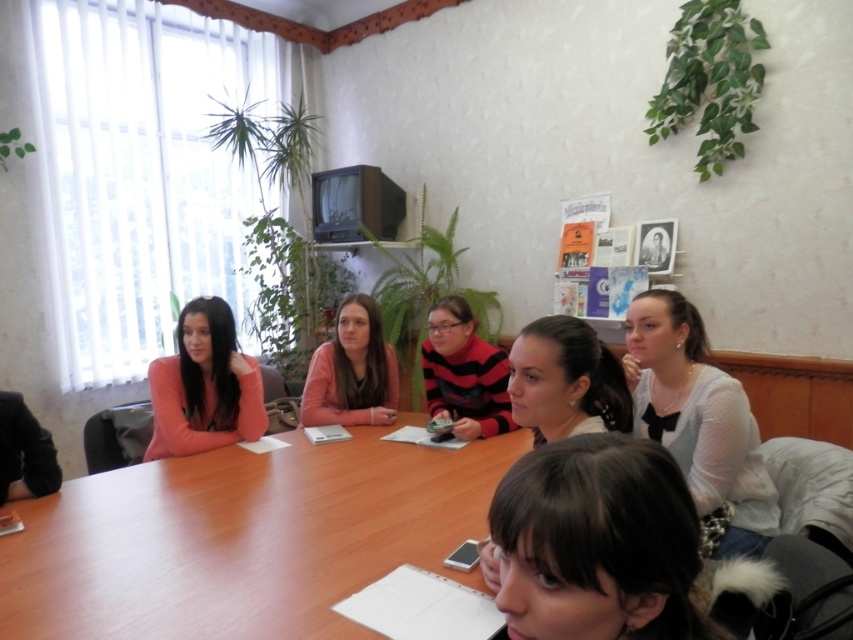
You are a photographer trying to capture a closeup of the dark brown hair at lower center without the smooth brown hair at center appearing in the frame. Is this possible based on their positions?

Yes, since the dark brown hair at lower center is in front of the smooth brown hair at center, you can focus on the dark brown hair at lower center and exclude the smooth brown hair at center from the frame by adjusting your angle or zoom.

From the picture: You are a photographer trying to capture a closeup of the dark brown hair at lower center and the smooth brown hair at center. Which hair is shorter and therefore easier to focus on without adjusting your camera lens?

The dark brown hair at lower center is shorter than the smooth brown hair at center, so it would be easier to focus on without adjusting the camera lens.

You are a photographer standing behind the long wooden table in the meeting room. You want to take a photo of the white matte sweater at center and the smooth brown hair at center so that both are clearly visible. Based on their distance apart, can you fit both into your camera frame if your camera has a maximum field of view that can capture objects up to 16 inches apart?

The white matte sweater at center and the smooth brown hair at center are 16.40 inches apart. Since the camera can only capture up to 16 inches, the distance between them exceeds the camera field of view. Therefore, you cannot fit both into the frame.